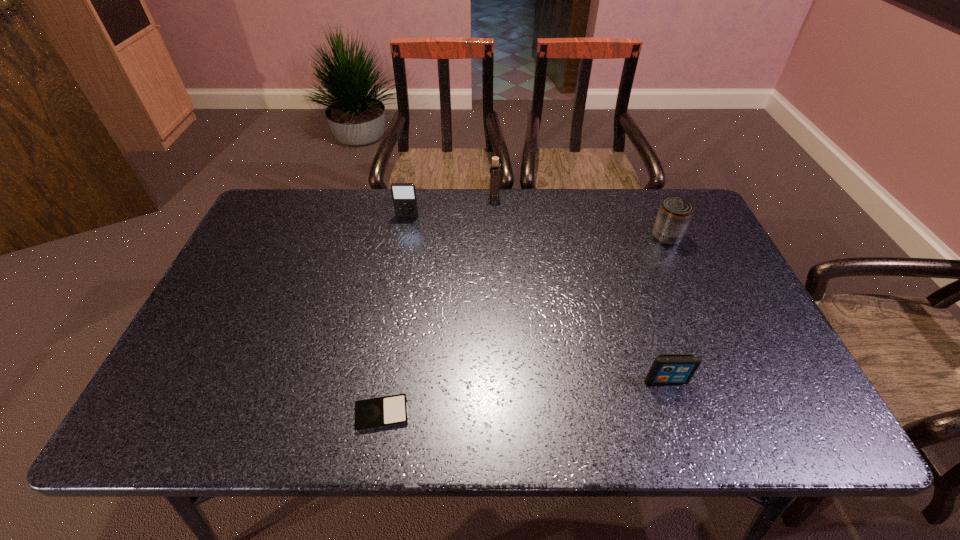
At what (x,y) coordinates should I click in order to perform the action: click on the tallest object. Please return your answer as a coordinate pair (x, y). Image resolution: width=960 pixels, height=540 pixels. Looking at the image, I should click on (494, 195).

Locate an element on the screen. the third object from right to left is located at coordinates (494, 195).

Where is `the farthest iPod`? This screenshot has height=540, width=960. the farthest iPod is located at coordinates (404, 196).

Find the location of a particular element. the tallest iPod is located at coordinates (404, 196).

I want to click on the rightmost object, so (674, 216).

This screenshot has height=540, width=960. Identify the location of the third farthest object. (674, 216).

Locate an element on the screen. The width and height of the screenshot is (960, 540). the second farthest iPod is located at coordinates (667, 368).

Find the location of `the second shortest iPod`. the second shortest iPod is located at coordinates (667, 368).

The height and width of the screenshot is (540, 960). I want to click on the shortest iPod, so click(x=387, y=411).

This screenshot has height=540, width=960. In order to click on the nearest object in this screenshot , I will do `click(387, 411)`.